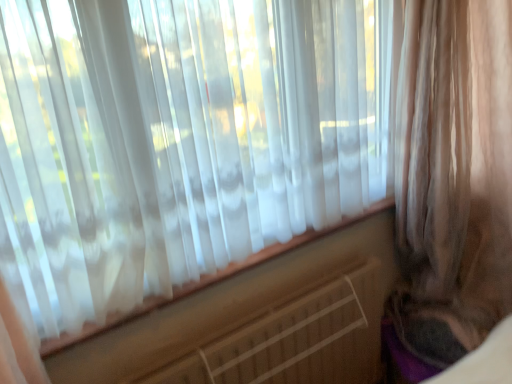
Question: From a real-world perspective, is sheer beige curtain at right above or below white plastic radiator at center?

Choices:
 (A) below
 (B) above

Answer: (B)

Question: From the image's perspective, is sheer beige curtain at right above or below white plastic radiator at center?

Choices:
 (A) above
 (B) below

Answer: (A)

Question: Relative to white plastic radiator at center, is sheer beige curtain at right in front or behind?

Choices:
 (A) front
 (B) behind

Answer: (A)

Question: Is white plastic radiator at center to the left or to the right of sheer beige curtain at right in the image?

Choices:
 (A) right
 (B) left

Answer: (B)

Question: Is white plastic radiator at center situated inside sheer beige curtain at right or outside?

Choices:
 (A) outside
 (B) inside

Answer: (A)

Question: Is white plastic radiator at center bigger or smaller than sheer beige curtain at right?

Choices:
 (A) small
 (B) big

Answer: (A)

Question: Is point (325, 352) positioned closer to the camera than point (496, 125)?

Choices:
 (A) farther
 (B) closer

Answer: (A)